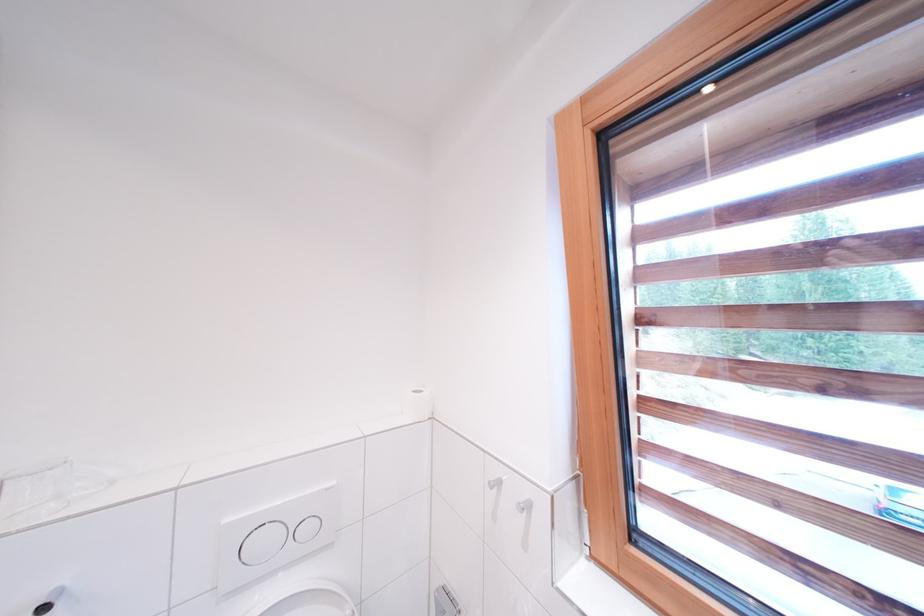
You are a GUI agent. You are given a task and a screenshot of the screen. Output one action in this format:
    pyautogui.click(x=<x>, y=<y>)
    Task: Click on the white toilet seat
    
    Given the screenshot: What is the action you would take?
    pyautogui.click(x=311, y=602)